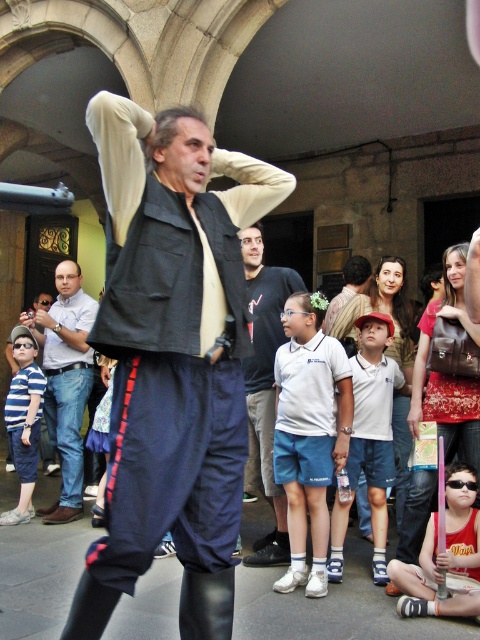
Based on the scene description, where is the white cotton shirt at center located in terms of coordinates?

The white cotton shirt at center is located at coordinates point (373, 426).

From the picture: You are a photographer trying to capture a candid shot of the performer. You notice two clothing items on the performer that are both at the center of the image. Which one is positioned to the right, the leather jacket at center or the white cotton shirt at center?

The leather jacket at center is positioned to the right of the white cotton shirt at center.

You are standing at the point labeled as point (373, 426) in the image. What object is directly beneath you?

The point (373, 426) is on white cotton shirt at center, so the object directly beneath you is the white cotton shirt at center.